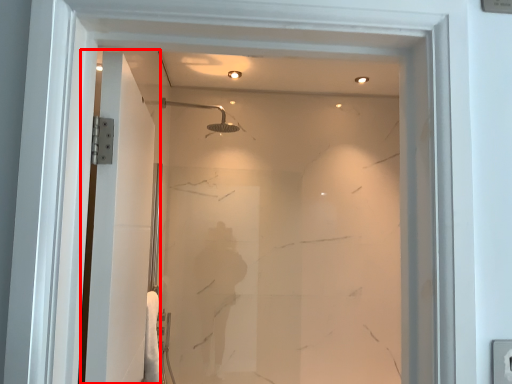
Question: In this image, where is screen door (annotated by the red box) located relative to shower?

Choices:
 (A) right
 (B) left

Answer: (B)